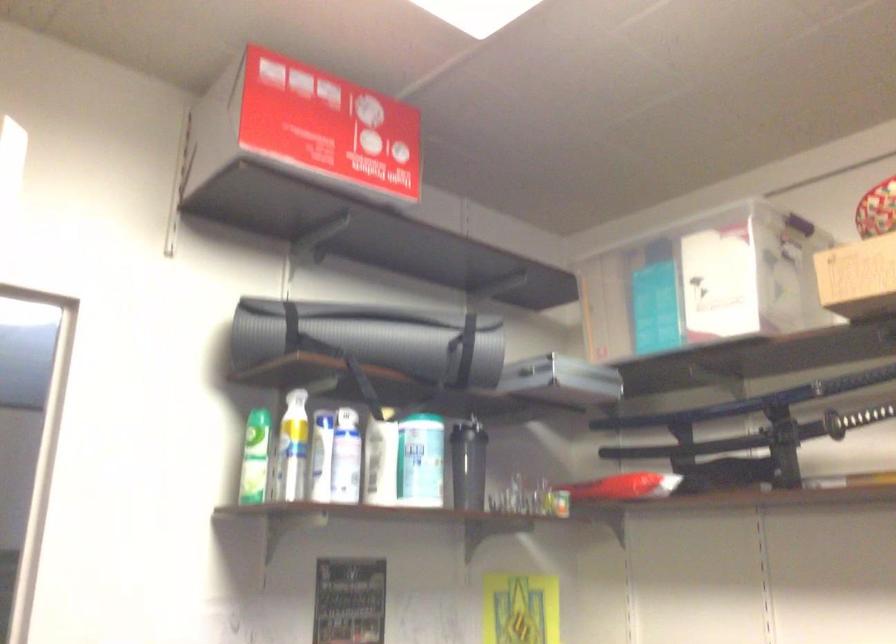
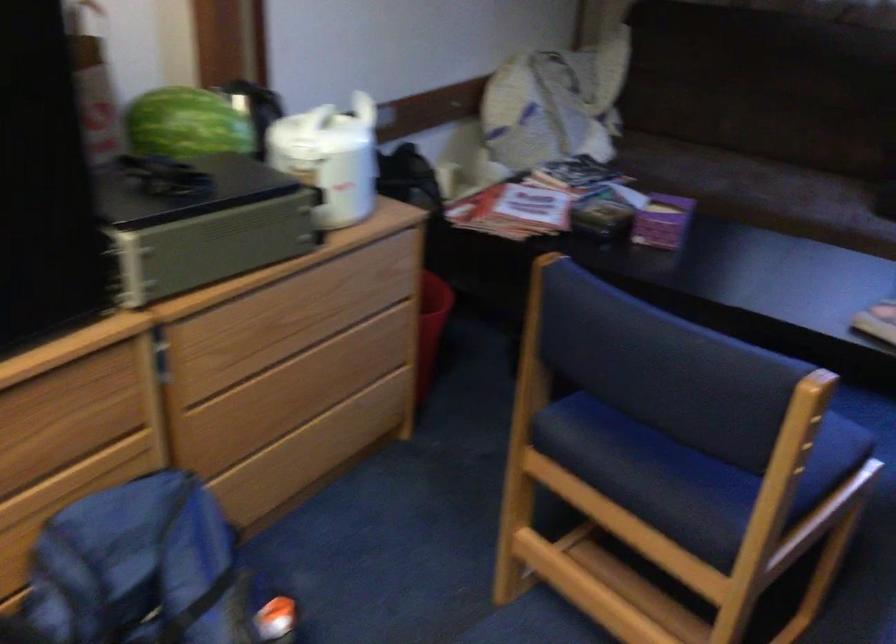
The images are taken continuously from a first-person perspective. In which direction is your viewpoint rotating?

The camera's rotation is toward right-down.